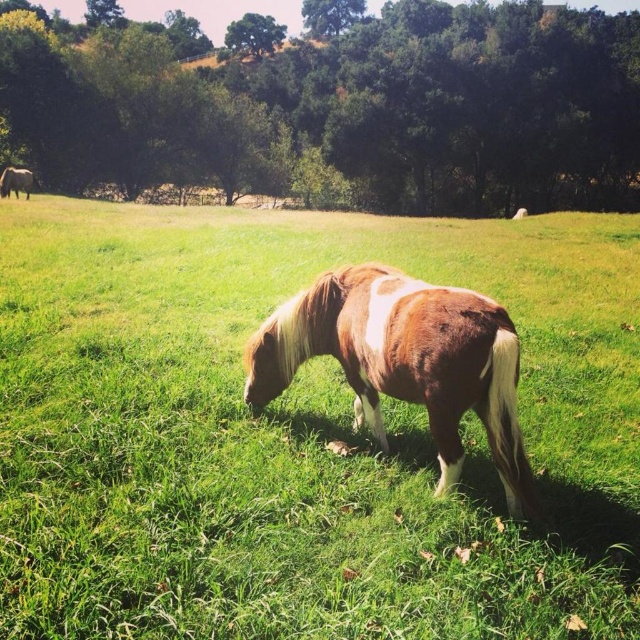
You are a photographer trying to capture the brown glossy horse at upper left in the image. Since the green grassy field at center is in front of the horse, will you need to adjust your camera angle to see the horse clearly?

The green grassy field at center has a lesser height compared to brown glossy horse at upper left, so the horse is taller than the grass. Therefore, you can adjust your camera angle slightly downward to see the horse clearly without obstruction from the grass.